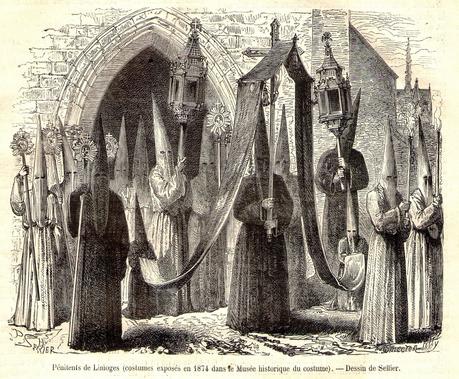
Where is `lantern`? The width and height of the screenshot is (459, 379). lantern is located at coordinates (188, 81), (323, 103).